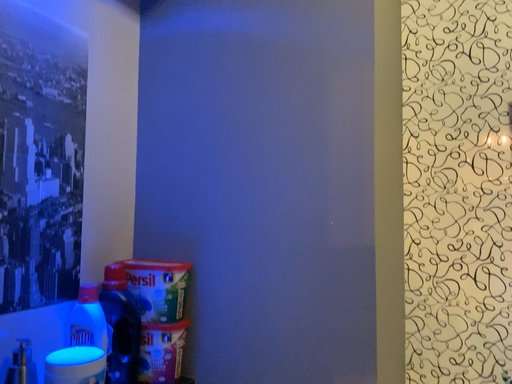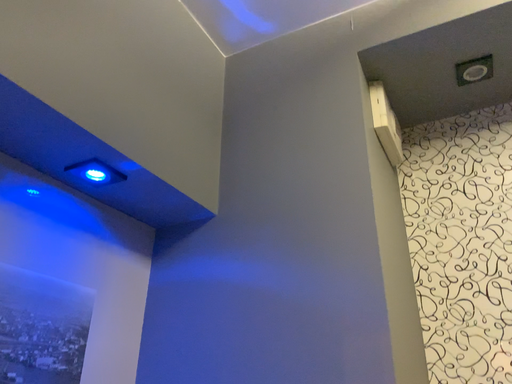
Question: Which way did the camera rotate in the video?

Choices:
 (A) rotated upward
 (B) rotated downward

Answer: (A)